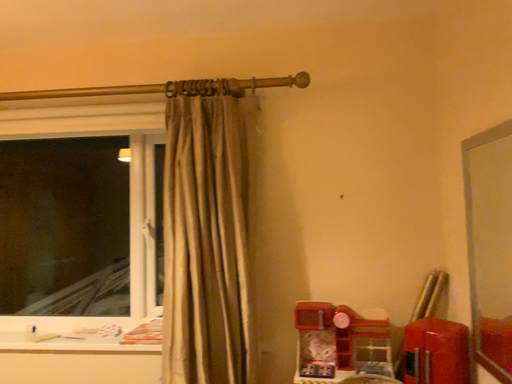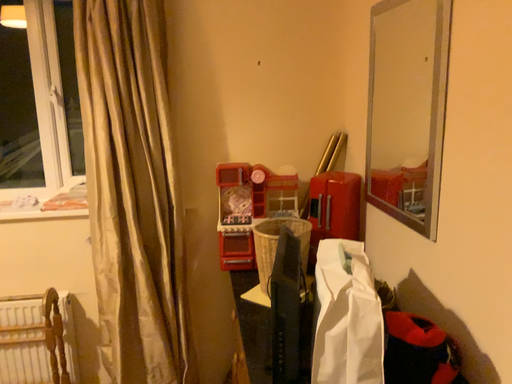
Question: How did the camera likely rotate when shooting the video?

Choices:
 (A) rotated downward
 (B) rotated upward

Answer: (A)